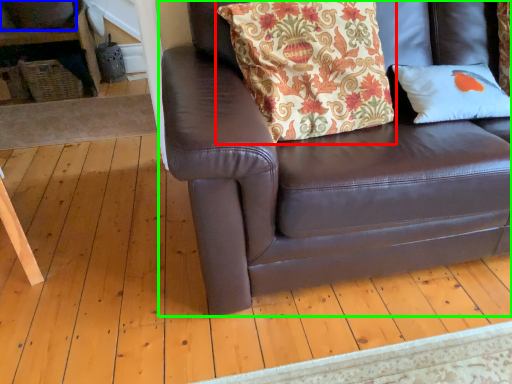
Question: Considering the real-world distances, which object is farthest from pillow (highlighted by a red box)? gray (highlighted by a blue box) or studio couch (highlighted by a green box)?

Choices:
 (A) gray
 (B) studio couch

Answer: (A)